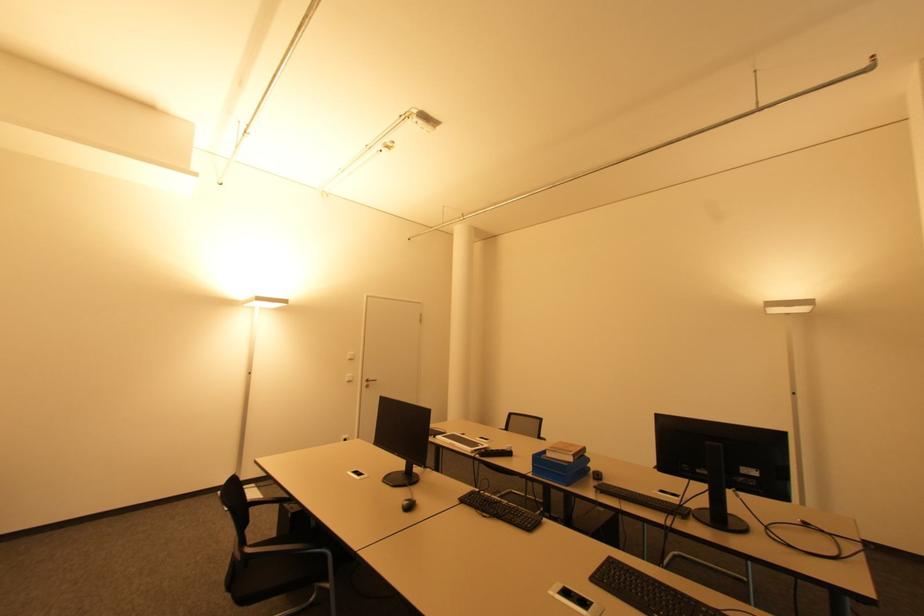
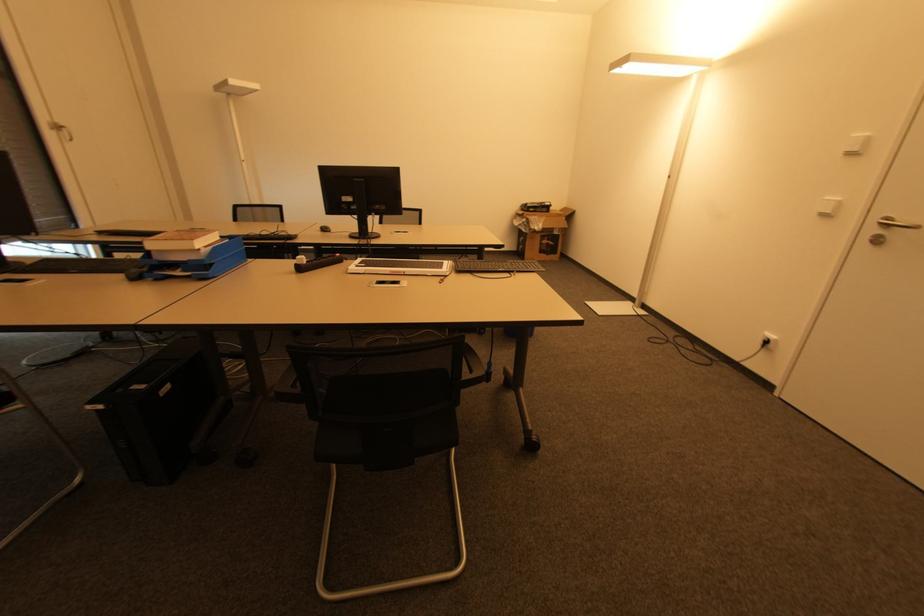
The point at (370,379) is marked in the first image. Where is the corresponding point in the second image?

(890, 221)